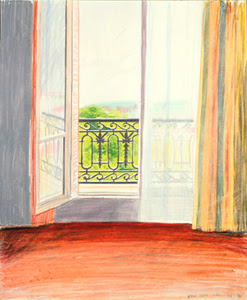
Locate an element on the screen. This screenshot has width=247, height=300. door is located at coordinates (64, 98), (162, 56).